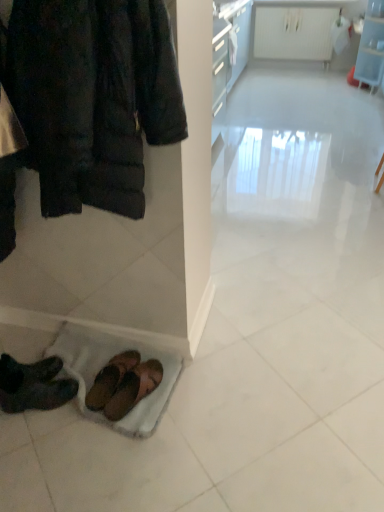
Question: Looking at their shapes, would you say dark brown leather shoes at lower left, the 3th footwear when ordered from right to left, is wider or thinner than brown leather sandals at lower left, the first footwear viewed from the right?

Choices:
 (A) thin
 (B) wide

Answer: (A)

Question: Choose the correct answer: Is dark brown leather shoes at lower left, the 3th footwear when ordered from right to left, inside brown leather sandals at lower left, the 3th footwear from the left, or outside it?

Choices:
 (A) outside
 (B) inside

Answer: (A)

Question: Estimate the real-world distances between objects in this image. Which object is farther from the brown suede sandals at lower center, which is counted as the 2th footwear, starting from the right?

Choices:
 (A) white glossy radiator at upper center, the first shelf positioned from the left
 (B) clear plastic shelf at upper right, which ranks as the 1th shelf in right-to-left order
 (C) dark brown quilted jacket at upper left
 (D) brown leather sandals at lower left, the 3th footwear from the left
 (E) dark brown leather shoes at lower left, the first footwear positioned from the left

Answer: (A)

Question: Which object is the closest to the brown leather sandals at lower left, the first footwear viewed from the right?

Choices:
 (A) clear plastic shelf at upper right, placed as the second shelf when sorted from left to right
 (B) dark brown quilted jacket at upper left
 (C) brown suede sandals at lower center, which ranks as the second footwear in left-to-right order
 (D) white glossy radiator at upper center, the second shelf from the right
 (E) dark brown leather shoes at lower left, the first footwear positioned from the left

Answer: (C)